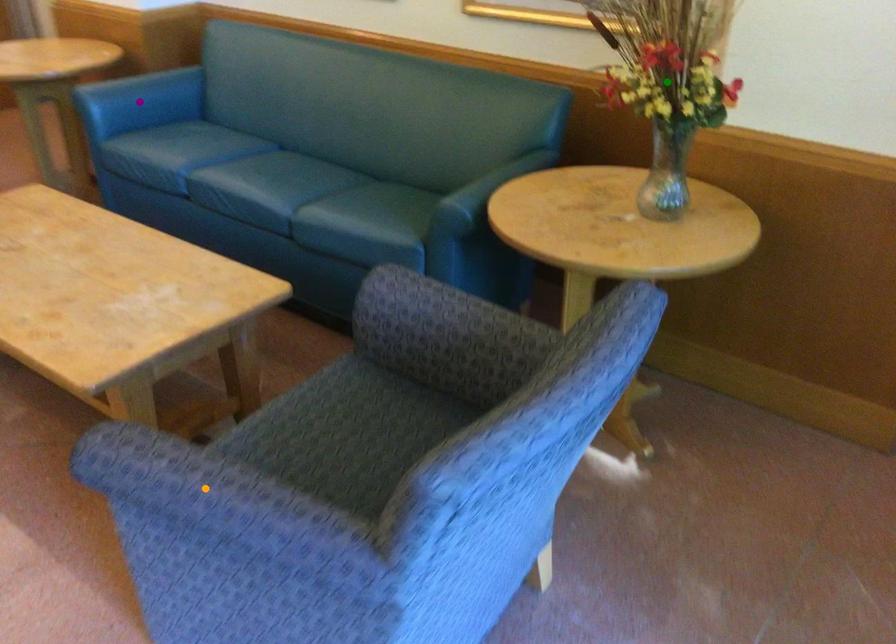
Order these from nearest to farthest:
orange point
green point
purple point

orange point → green point → purple point